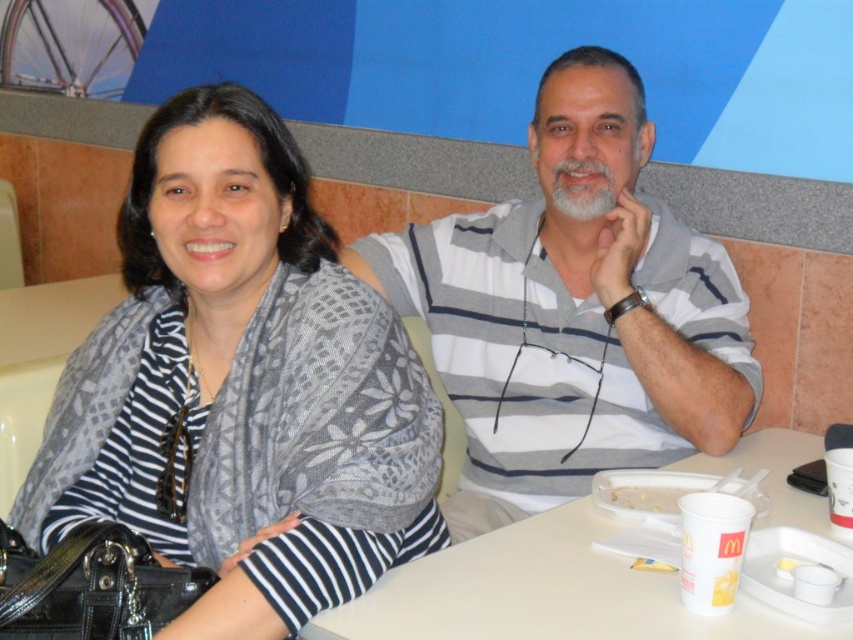
Question: Is gray striped shirt at center to the left of white paper tray at lower center from the viewer's perspective?

Choices:
 (A) no
 (B) yes

Answer: (B)

Question: Which object is closer to the camera taking this photo?

Choices:
 (A) white plastic tray at lower center
 (B) white paper tray at lower center

Answer: (A)

Question: Which point is farther from the camera taking this photo?

Choices:
 (A) (643, 512)
 (B) (556, 374)
 (C) (601, 625)

Answer: (B)

Question: Is striped fabric scarf at left closer to camera compared to white plastic tray at lower center?

Choices:
 (A) yes
 (B) no

Answer: (A)

Question: Does white plastic tray at lower center appear under white paper tray at lower center?

Choices:
 (A) yes
 (B) no

Answer: (A)

Question: Which point is closer to the camera?

Choices:
 (A) (636, 502)
 (B) (479, 560)

Answer: (B)